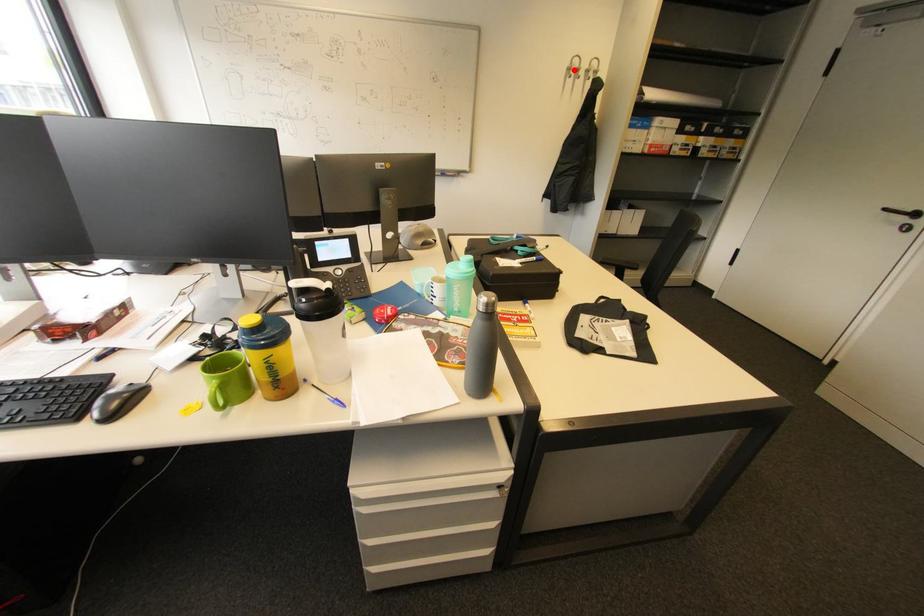
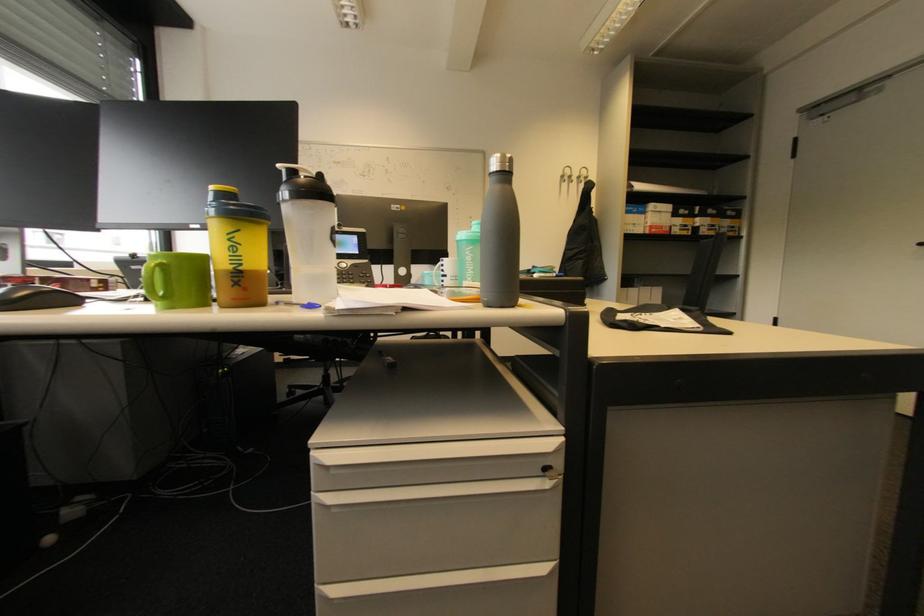
In the second image, find the point that corresponds to the highlighted location in the first image.

(567, 177)